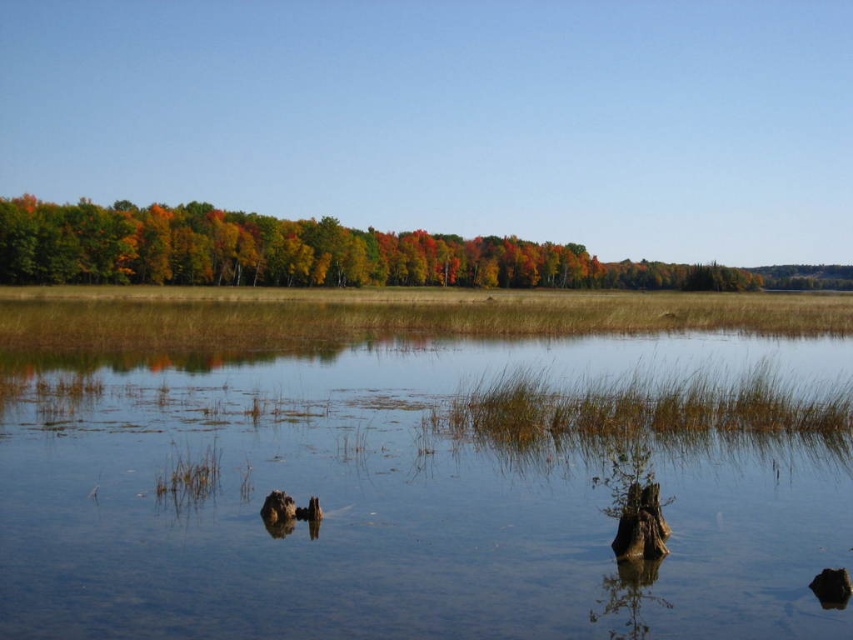
Question: Can you confirm if clear water at center is positioned to the right of multicolored foliage at center?

Choices:
 (A) yes
 (B) no

Answer: (A)

Question: Which object appears closest to the camera in this image?

Choices:
 (A) multicolored foliage at center
 (B) clear water at center

Answer: (B)

Question: Can you confirm if clear water at center is thinner than multicolored foliage at center?

Choices:
 (A) yes
 (B) no

Answer: (A)

Question: In this image, where is clear water at center located relative to multicolored foliage at center?

Choices:
 (A) below
 (B) above

Answer: (A)